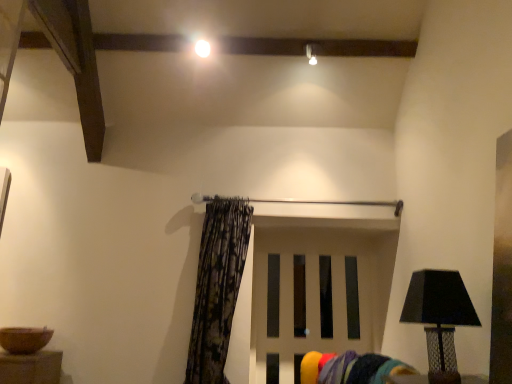
Question: From a real-world perspective, is black textured lamp at right under white matte door at center?

Choices:
 (A) yes
 (B) no

Answer: (A)

Question: From the image's perspective, is black textured lamp at right located above white matte door at center?

Choices:
 (A) no
 (B) yes

Answer: (B)

Question: Is black textured lamp at right wider than white matte door at center?

Choices:
 (A) no
 (B) yes

Answer: (B)

Question: Is black textured lamp at right bigger than white matte door at center?

Choices:
 (A) yes
 (B) no

Answer: (B)

Question: Considering the relative sizes of black textured lamp at right and white matte door at center in the image provided, is black textured lamp at right smaller than white matte door at center?

Choices:
 (A) yes
 (B) no

Answer: (A)

Question: Is black textured lamp at right outside of white matte door at center?

Choices:
 (A) no
 (B) yes

Answer: (B)

Question: Is printed fabric curtain at center further to the viewer compared to white glossy light bulb at upper center?

Choices:
 (A) yes
 (B) no

Answer: (B)

Question: From a real-world perspective, is printed fabric curtain at center below white glossy light bulb at upper center?

Choices:
 (A) no
 (B) yes

Answer: (B)

Question: Considering the relative sizes of printed fabric curtain at center and white glossy light bulb at upper center in the image provided, is printed fabric curtain at center shorter than white glossy light bulb at upper center?

Choices:
 (A) yes
 (B) no

Answer: (B)

Question: From the image's perspective, would you say printed fabric curtain at center is positioned over white glossy light bulb at upper center?

Choices:
 (A) no
 (B) yes

Answer: (A)

Question: Is printed fabric curtain at center completely or partially outside of white glossy light bulb at upper center?

Choices:
 (A) yes
 (B) no

Answer: (A)

Question: Is the position of printed fabric curtain at center less distant than that of white glossy light bulb at upper center?

Choices:
 (A) yes
 (B) no

Answer: (A)

Question: Is black textured lamp at right facing towards velvet yellow swivel chair at lower center?

Choices:
 (A) yes
 (B) no

Answer: (B)